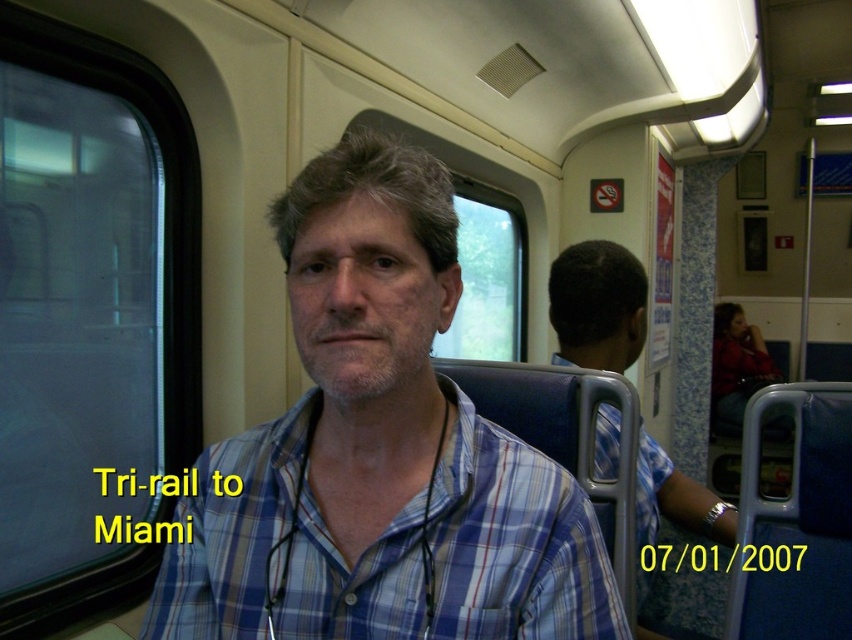
You are a passenger on the Tri Rail train heading to Miami. You notice two people wearing blue plaid shirts. Which one is closer to you, the blue plaid shirt at center or the blue plaid shirt at right?

The blue plaid shirt at center is closer to the viewer than the blue plaid shirt at right.

You are a passenger on the Tri Rail train heading to Miami. You need to reach the blue plaid shirt at right to ask a question, but you can only move 30 inches forward from your current position at the blue plaid shirt at center. Can you reach them?

The blue plaid shirt at center is 29.49 inches away from the blue plaid shirt at right. Since you can move 30 inches forward, you can reach them.